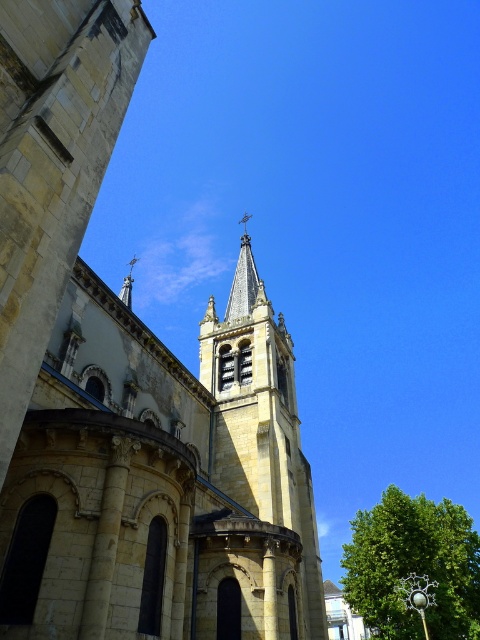
Is yellow stone tower at center to the left of green leafy tree at lower right from the viewer's perspective?

Yes, yellow stone tower at center is to the left of green leafy tree at lower right.

Is yellow stone tower at center smaller than green leafy tree at lower right?

Correct, yellow stone tower at center occupies less space than green leafy tree at lower right.

The image size is (480, 640). What are the coordinates of `yellow stone tower at center` in the screenshot? It's located at (255, 474).

Identify the location of yellow stone tower at center. The height and width of the screenshot is (640, 480). (255, 474).

Based on the photo, is yellow stone tower at center further to camera compared to smooth gray stone spire at upper center?

No, yellow stone tower at center is closer to the viewer.

Is point (279, 605) positioned behind point (237, 269)?

No, (279, 605) is closer to viewer.

I want to click on yellow stone tower at center, so click(255, 474).

In the scene shown: Can you confirm if yellow stone church steeple at center is smaller than smooth gray stone spire at upper center?

No.

Who is positioned more to the left, yellow stone church steeple at center or smooth gray stone spire at upper center?

yellow stone church steeple at center

Locate an element on the screen. yellow stone church steeple at center is located at coordinates (129, 390).